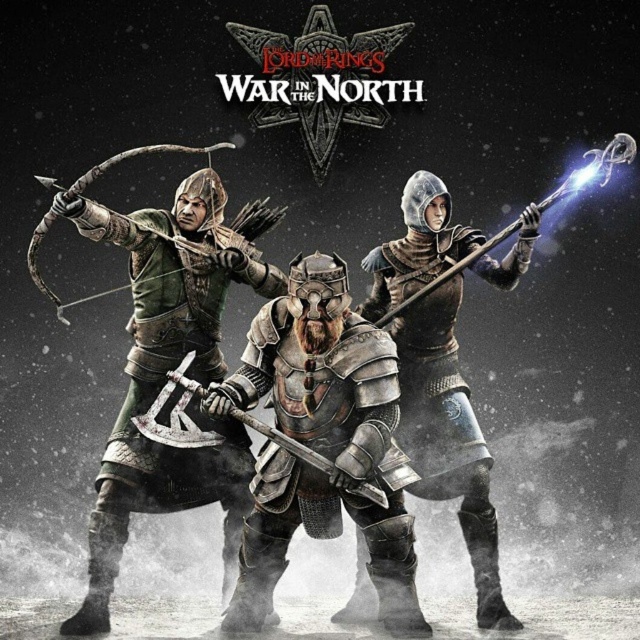
Is green leather armor at left shorter than shiny silver armor at center?

In fact, green leather armor at left may be taller than shiny silver armor at center.

Is green leather armor at left smaller than shiny silver armor at center?

Actually, green leather armor at left might be larger than shiny silver armor at center.

Does point (163, 150) lie in front of point (436, 209)?

No, it is not.

Locate an element on the screen. Image resolution: width=640 pixels, height=640 pixels. green leather armor at left is located at coordinates (168, 360).

Is shiny silver armor at center wider than shiny silver staff at center?

No.

At what (x,y) coordinates should I click in order to perform the action: click on shiny silver armor at center. Please return your answer as a coordinate pair (x, y). This screenshot has height=640, width=640. Looking at the image, I should click on (449, 436).

Locate an element on the screen. shiny silver armor at center is located at coordinates (449, 436).

Is green leather armor at left positioned at the back of polished silver armor at center?

Yes.

Is green leather armor at left smaller than polished silver armor at center?

No, green leather armor at left is not smaller than polished silver armor at center.

Locate an element on the screen. green leather armor at left is located at coordinates [x=168, y=360].